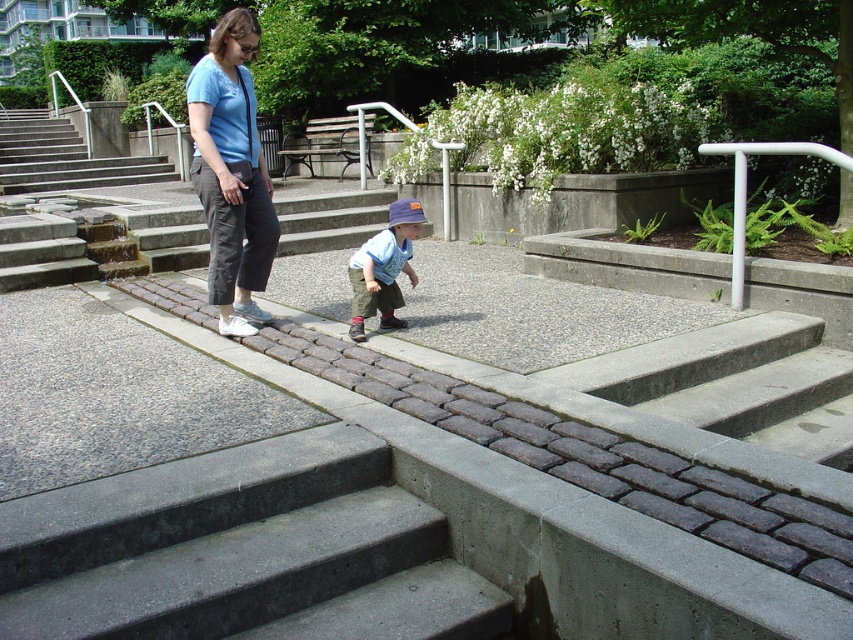
Question: Estimate the real-world distances between objects in this image. Which object is farther from the concrete steps at upper left?

Choices:
 (A) matte blue shirt at center
 (B) concrete steps at lower center

Answer: (B)

Question: Estimate the real-world distances between objects in this image. Which object is closer to the blue cotton shirt at center?

Choices:
 (A) matte blue shirt at center
 (B) concrete steps at lower center

Answer: (A)

Question: Is matte blue shirt at center to the left of concrete steps at upper left from the viewer's perspective?

Choices:
 (A) yes
 (B) no

Answer: (B)

Question: Does concrete steps at upper left have a greater width compared to silver metallic handrail at upper right?

Choices:
 (A) yes
 (B) no

Answer: (A)

Question: Which of the following is the closest to the observer?

Choices:
 (A) (49, 189)
 (B) (399, 234)
 (C) (27, 579)
 (D) (738, 230)

Answer: (C)

Question: Where is concrete steps at lower center located in relation to silver metallic handrail at upper right in the image?

Choices:
 (A) left
 (B) right

Answer: (A)